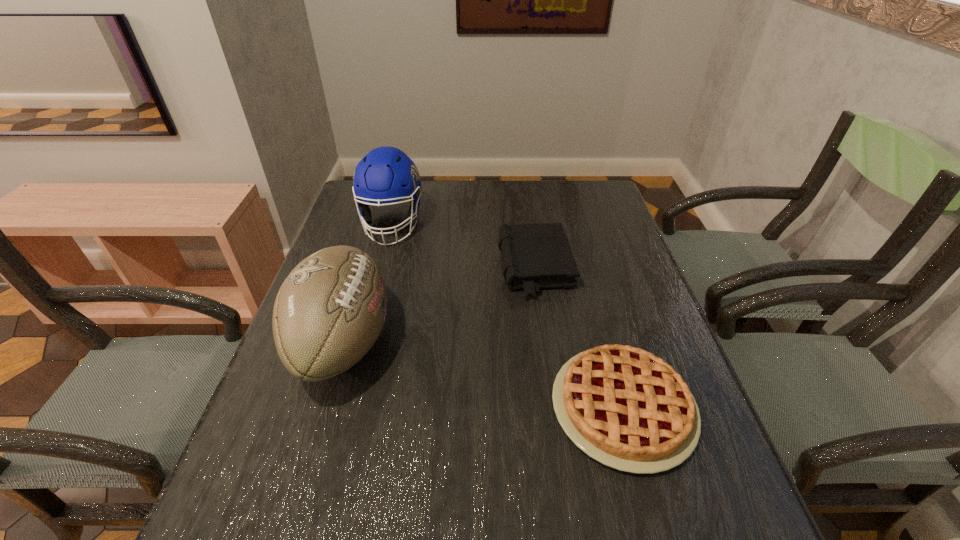
Find the location of a particular element. The image size is (960, 540). football helmet is located at coordinates (386, 175).

What are the coordinates of `football (American)` in the screenshot? It's located at (330, 310).

You are a GUI agent. You are given a task and a screenshot of the screen. Output one action in this format:
    pyautogui.click(x=<x>, y=<y>)
    Task: Click on the Bible
    The height and width of the screenshot is (540, 960).
    Given the screenshot: What is the action you would take?
    pyautogui.click(x=536, y=256)

Find the location of `pie`. pie is located at coordinates (628, 409).

Identify the location of vacant position located 0.290m on the front-facing side of the football helmet. (365, 325).

Identify the location of free location located 0.150m on the laces of the football (American). This screenshot has width=960, height=540. (457, 342).

You are a GUI agent. You are given a task and a screenshot of the screen. Output one action in this format:
    pyautogui.click(x=<x>, y=<y>)
    Task: Click on the free space located on the left of the third tallest object
    The height and width of the screenshot is (540, 960).
    Given the screenshot: What is the action you would take?
    pyautogui.click(x=462, y=268)

Find the location of a particular element. The width and height of the screenshot is (960, 540). free region located 0.050m on the back of the pie is located at coordinates (603, 335).

This screenshot has width=960, height=540. Identify the location of object that is at the far edge. [386, 175].

You are a GUI agent. You are given a task and a screenshot of the screen. Output one action in this format:
    pyautogui.click(x=<x>, y=<y>)
    Task: Click on the football helmet located in the left edge section of the desktop
    This screenshot has height=540, width=960.
    Given the screenshot: What is the action you would take?
    tap(386, 175)